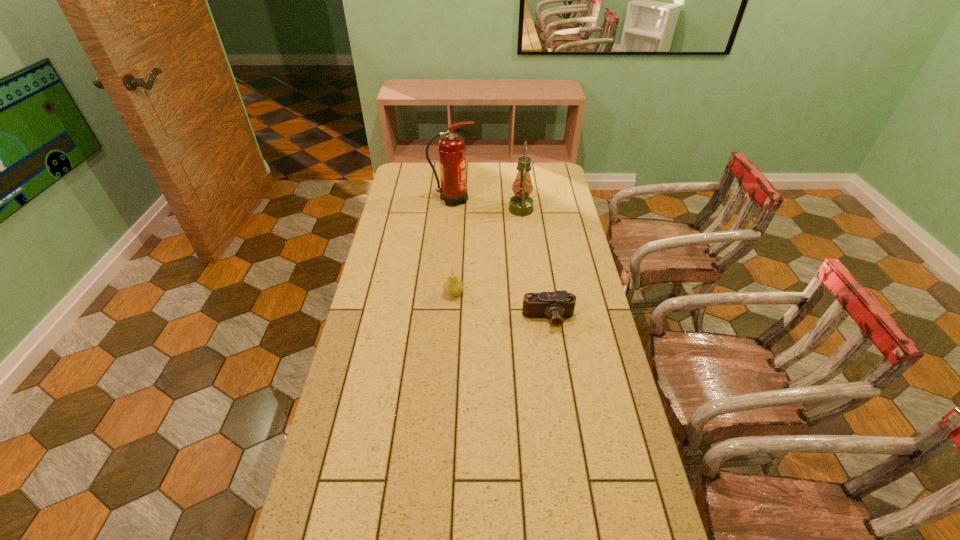
This screenshot has width=960, height=540. I want to click on free space between the second tallest object and the second nearest object, so click(488, 252).

Locate which object ranks third in proximity to the oil lamp. Please provide its 2D coordinates. Your answer should be formatted as a tuple, i.e. [(x, y)], where the tuple contains the x and y coordinates of a point satisfying the conditions above.

[(556, 305)]

Point out which object is positioned as the nearest to the second nearest object. Please provide its 2D coordinates. Your answer should be formatted as a tuple, i.e. [(x, y)], where the tuple contains the x and y coordinates of a point satisfying the conditions above.

[(556, 305)]

Find the location of `free space that satisfies the following two spatial constraints: 1. on the back side of the third farthest object; 2. on the front-facing side of the fire extinguisher`. free space that satisfies the following two spatial constraints: 1. on the back side of the third farthest object; 2. on the front-facing side of the fire extinguisher is located at coordinates (459, 199).